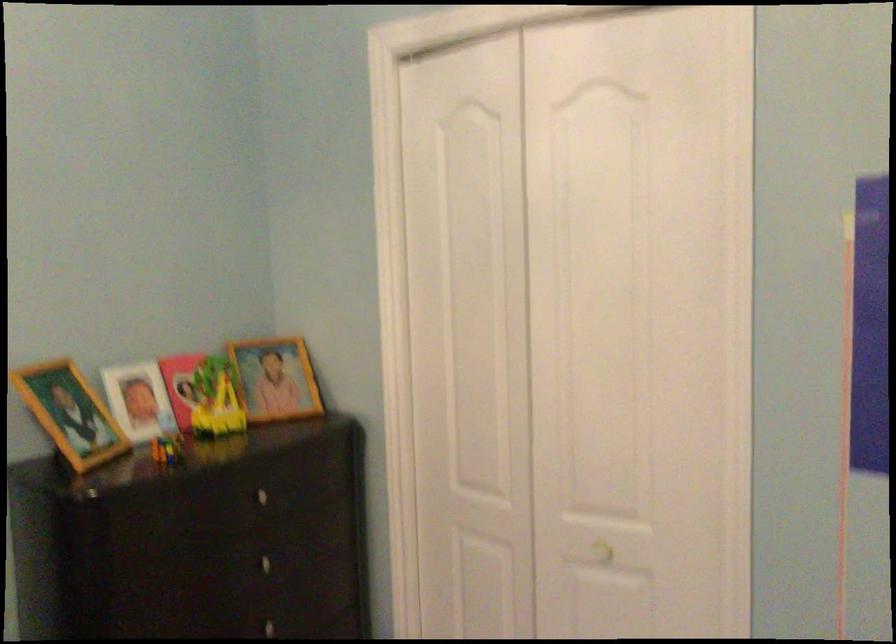
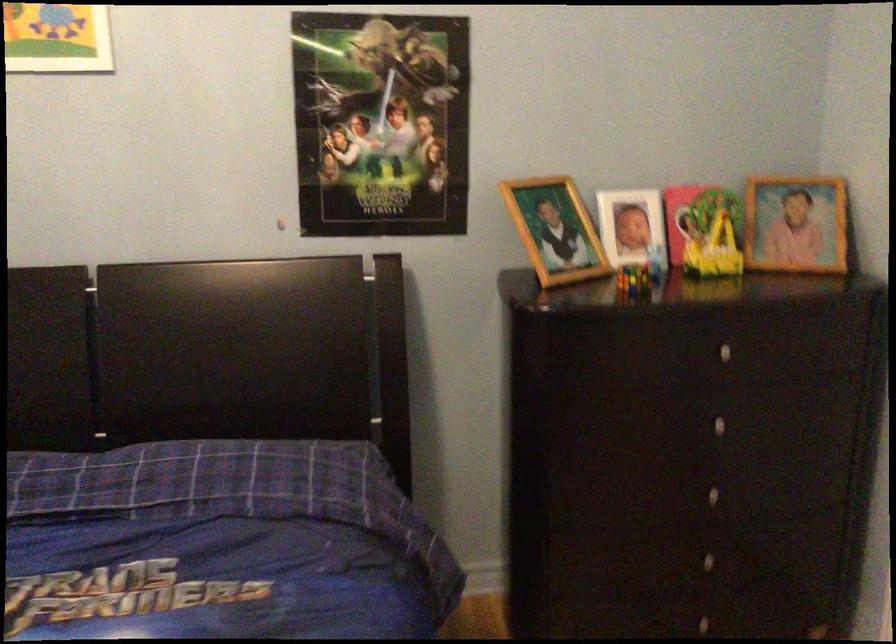
The point at (168, 450) is marked in the first image. Where is the corresponding point in the second image?

(634, 279)